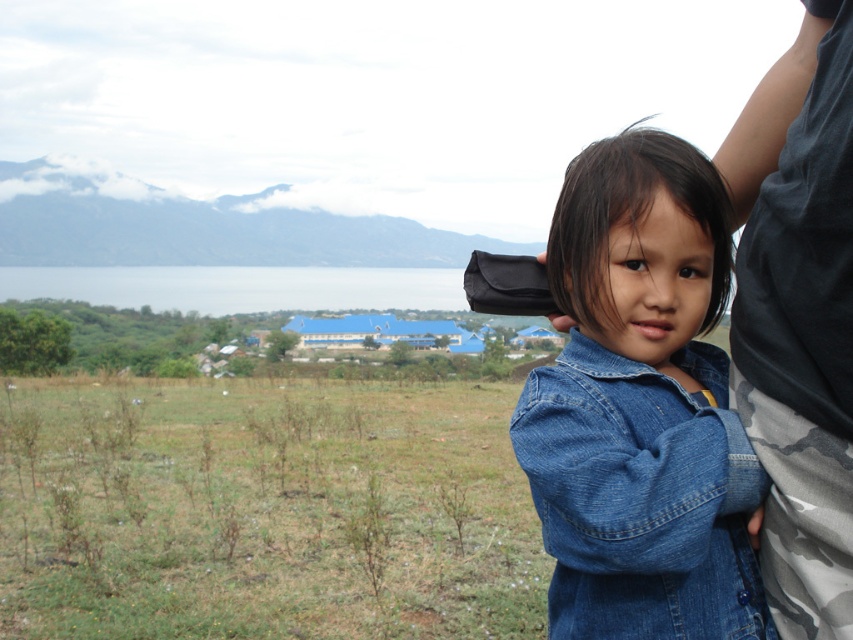
Question: Does green grass at lower left appear on the left side of denim jacket at lower right?

Choices:
 (A) yes
 (B) no

Answer: (A)

Question: Considering the real-world distances, which object is closest to the denim jacket at lower right?

Choices:
 (A) green grass at lower left
 (B) dark gray/camo-patterned pants at right

Answer: (B)

Question: Which point is farther from the camera taking this photo?

Choices:
 (A) (834, 380)
 (B) (572, 186)

Answer: (B)

Question: Estimate the real-world distances between objects in this image. Which object is farther from the denim jacket at lower right?

Choices:
 (A) green grass at lower left
 (B) dark gray/camo-patterned pants at right

Answer: (A)

Question: Does green grass at lower left lie in front of dark gray/camo-patterned pants at right?

Choices:
 (A) no
 (B) yes

Answer: (A)

Question: Does green grass at lower left have a greater width compared to dark gray/camo-patterned pants at right?

Choices:
 (A) no
 (B) yes

Answer: (B)